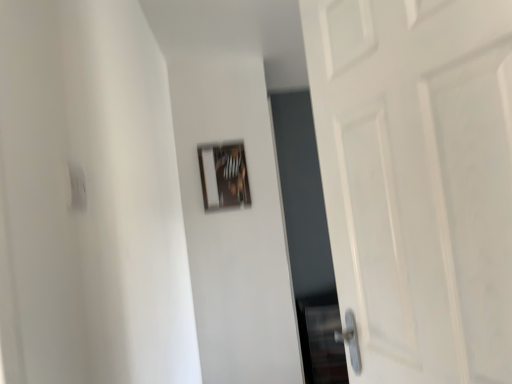
Question: Should I look upward or downward to see wooden frame at upper center?

Choices:
 (A) up
 (B) down

Answer: (A)